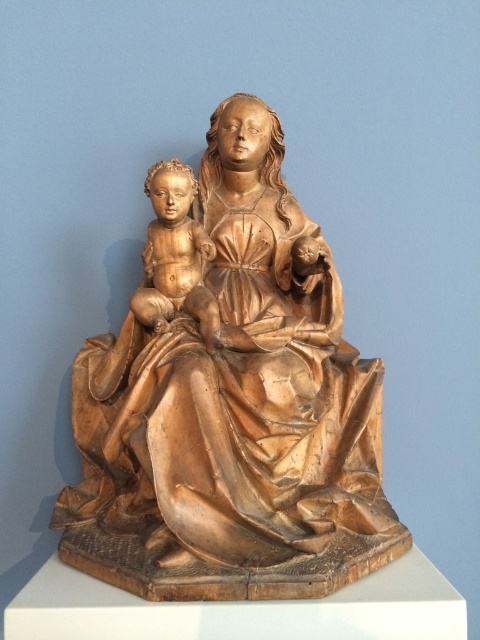
How much distance is there between wooden statue at center and wooden baby at center?

A distance of 6.83 inches exists between wooden statue at center and wooden baby at center.

Looking at this image, who is positioned more to the left, wooden statue at center or wooden baby at center?

Positioned to the left is wooden baby at center.

The image size is (480, 640). Describe the element at coordinates (230, 403) in the screenshot. I see `wooden statue at center` at that location.

Locate an element on the screen. This screenshot has width=480, height=640. wooden statue at center is located at coordinates (230, 403).